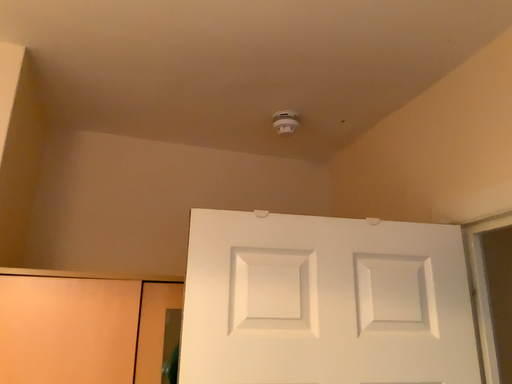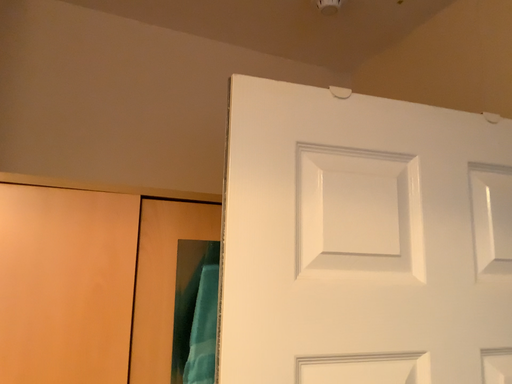
Question: How did the camera likely rotate when shooting the video?

Choices:
 (A) rotated downward
 (B) rotated upward

Answer: (A)